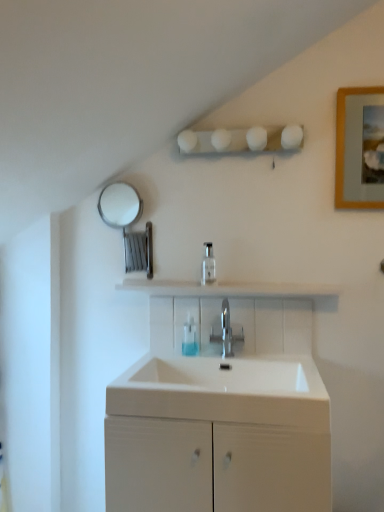
Question: From a real-world perspective, is wooden picture frame at upper right physically above white glossy shelf at center?

Choices:
 (A) yes
 (B) no

Answer: (A)

Question: Is wooden picture frame at upper right placed right next to white glossy shelf at center?

Choices:
 (A) yes
 (B) no

Answer: (B)

Question: From the image's perspective, is wooden picture frame at upper right on white glossy shelf at center?

Choices:
 (A) no
 (B) yes

Answer: (B)

Question: Considering the relative positions of wooden picture frame at upper right and white glossy shelf at center in the image provided, is wooden picture frame at upper right behind white glossy shelf at center?

Choices:
 (A) no
 (B) yes

Answer: (A)

Question: Can you confirm if wooden picture frame at upper right is thinner than white glossy shelf at center?

Choices:
 (A) no
 (B) yes

Answer: (B)

Question: In terms of width, does polished metallic tap at center look wider or thinner when compared to white matte cabinet at center?

Choices:
 (A) thin
 (B) wide

Answer: (A)

Question: Do you think polished metallic tap at center is within white matte cabinet at center, or outside of it?

Choices:
 (A) inside
 (B) outside

Answer: (B)

Question: From the image's perspective, is polished metallic tap at center located above or below white matte cabinet at center?

Choices:
 (A) above
 (B) below

Answer: (A)

Question: From their relative heights in the image, would you say polished metallic tap at center is taller or shorter than white matte cabinet at center?

Choices:
 (A) short
 (B) tall

Answer: (A)

Question: From the image's perspective, is white glossy soap dispenser at center positioned above or below translucent plastic soap dispenser at center?

Choices:
 (A) above
 (B) below

Answer: (A)

Question: Considering the positions of white glossy soap dispenser at center and translucent plastic soap dispenser at center in the image, is white glossy soap dispenser at center bigger or smaller than translucent plastic soap dispenser at center?

Choices:
 (A) small
 (B) big

Answer: (B)

Question: Is point (210, 266) closer or farther from the camera than point (190, 333)?

Choices:
 (A) farther
 (B) closer

Answer: (B)

Question: From a real-world perspective, is white glossy soap dispenser at center physically located above or below translucent plastic soap dispenser at center?

Choices:
 (A) below
 (B) above

Answer: (B)

Question: Would you say white glossy shelf at center is to the left or to the right of white glossy sink at center in the picture?

Choices:
 (A) left
 (B) right

Answer: (B)

Question: Is point (279, 288) closer or farther from the camera than point (107, 387)?

Choices:
 (A) farther
 (B) closer

Answer: (A)